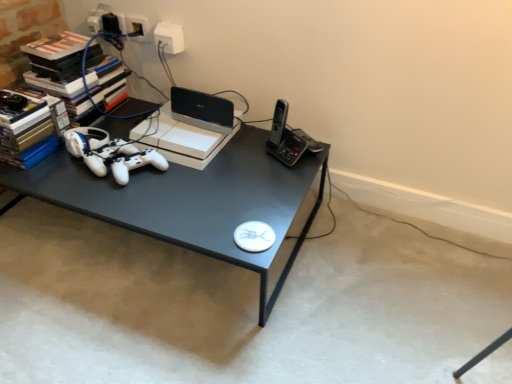
Question: Considering the relative sizes of white plastic outlet at upper center and black plastic router at upper center in the image provided, is white plastic outlet at upper center thinner than black plastic router at upper center?

Choices:
 (A) no
 (B) yes

Answer: (B)

Question: Does white plastic outlet at upper center come behind black plastic router at upper center?

Choices:
 (A) no
 (B) yes

Answer: (B)

Question: From a real-world perspective, is white plastic outlet at upper center on black plastic router at upper center?

Choices:
 (A) yes
 (B) no

Answer: (A)

Question: Is black plastic router at upper center at the back of white plastic outlet at upper center?

Choices:
 (A) yes
 (B) no

Answer: (B)

Question: From the image's perspective, is white plastic outlet at upper center located beneath black plastic router at upper center?

Choices:
 (A) no
 (B) yes

Answer: (A)

Question: Could you tell me if white plastic outlet at upper center is turned towards black plastic router at upper center?

Choices:
 (A) no
 (B) yes

Answer: (A)

Question: Could you tell me if white matte game controller at center is facing black plastic router at upper center?

Choices:
 (A) yes
 (B) no

Answer: (B)

Question: Considering the relative sizes of white matte game controller at center and black plastic router at upper center in the image provided, is white matte game controller at center bigger than black plastic router at upper center?

Choices:
 (A) yes
 (B) no

Answer: (B)

Question: Is white matte game controller at center smaller than black plastic router at upper center?

Choices:
 (A) no
 (B) yes

Answer: (B)

Question: Is white matte game controller at center turned away from black plastic router at upper center?

Choices:
 (A) no
 (B) yes

Answer: (B)

Question: Does white matte game controller at center appear on the right side of black plastic router at upper center?

Choices:
 (A) no
 (B) yes

Answer: (A)

Question: From a real-world perspective, is white matte game controller at center positioned over black plastic router at upper center based on gravity?

Choices:
 (A) no
 (B) yes

Answer: (A)

Question: From the image's perspective, does white plastic outlet at upper center appear lower than white matte game controller at center?

Choices:
 (A) no
 (B) yes

Answer: (A)